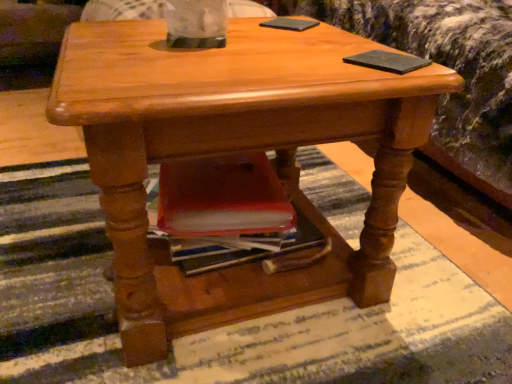
Locate an element on the screen. free space behind green matte pad at upper center, which ranks as the 1th pad in top-to-bottom order is located at coordinates (287, 18).